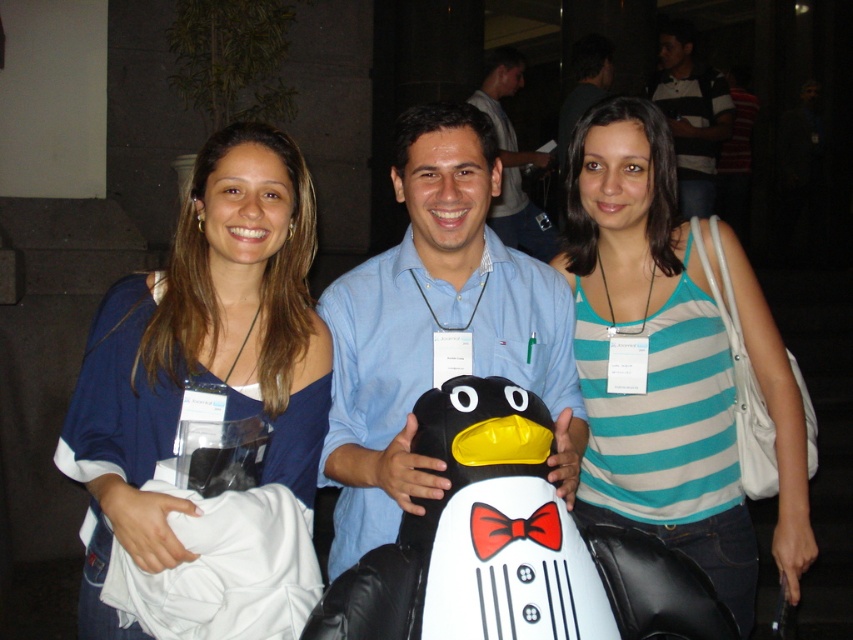
How far apart are teal striped tank top at center and blue fabric shirt at center?

A distance of 45.40 centimeters exists between teal striped tank top at center and blue fabric shirt at center.

Is teal striped tank top at center positioned before blue fabric shirt at center?

No.

Is point (645, 324) positioned in front of point (409, 140)?

No, it is behind (409, 140).

Where is `teal striped tank top at center`? teal striped tank top at center is located at coordinates (653, 353).

Does teal striped tank top at center lie behind blue fabric shirt at upper left?

Yes, teal striped tank top at center is behind blue fabric shirt at upper left.

Which is below, teal striped tank top at center or blue fabric shirt at upper left?

blue fabric shirt at upper left is below.

Does point (602, 157) lie behind point (136, 440)?

Yes, it is.

Locate an element on the screen. This screenshot has height=640, width=853. teal striped tank top at center is located at coordinates (653, 353).

Is striped cotton shirt at upper right positioned in front of matte blue shirt at center?

No, it is behind matte blue shirt at center.

Can you confirm if striped cotton shirt at upper right is positioned below matte blue shirt at center?

No.

Between point (698, 188) and point (531, 237), which one is positioned behind?

Point (698, 188)

Find the location of a particular element. The image size is (853, 640). striped cotton shirt at upper right is located at coordinates (691, 116).